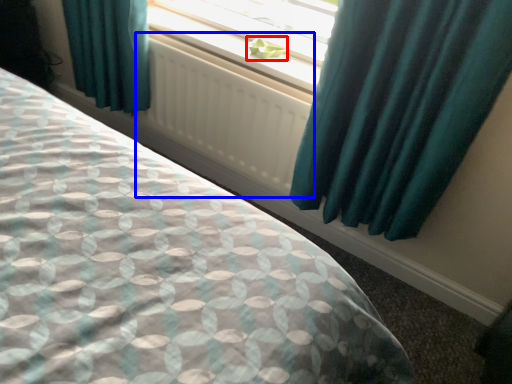
Question: Which of the following is the farthest to the observer, plant (highlighted by a red box) or radiator (highlighted by a blue box)?

Choices:
 (A) plant
 (B) radiator

Answer: (A)